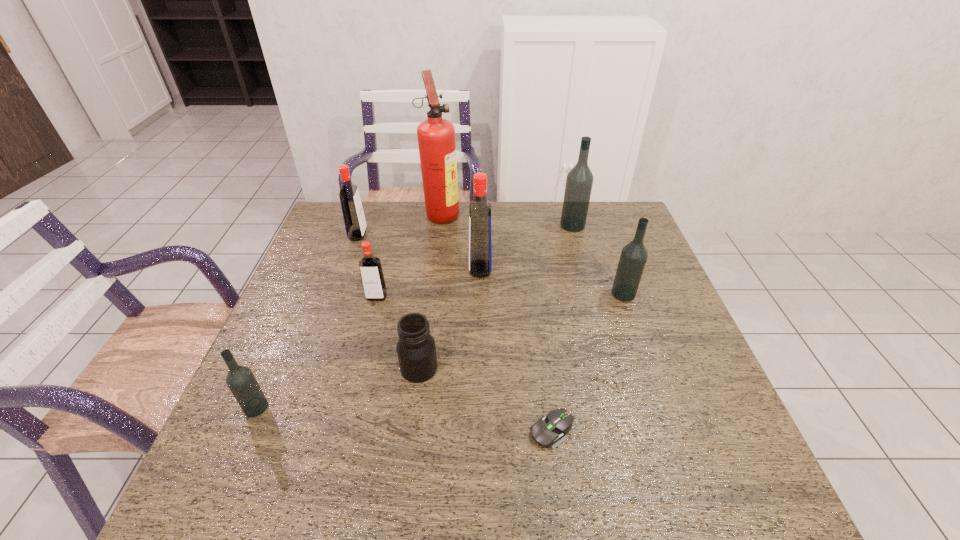
This screenshot has width=960, height=540. Find the location of `empty space between the farthest black vodka and the second smallest black vodka`. empty space between the farthest black vodka and the second smallest black vodka is located at coordinates (598, 259).

Locate an element on the screen. The image size is (960, 540). unoccupied area between the rightmost object and the second shortest object is located at coordinates (521, 331).

Where is `vacant space that is in between the rightmost vodka and the fourth nearest vodka`? vacant space that is in between the rightmost vodka and the fourth nearest vodka is located at coordinates (552, 281).

The height and width of the screenshot is (540, 960). In order to click on free spot between the nearest black vodka and the nearest red vodka in this screenshot , I will do coord(317,352).

What are the coordinates of `vacant space that is in between the tallest object and the seventh farthest object` in the screenshot? It's located at (430, 291).

Where is `object identified as the seventh closest to the second biggest black vodka`? The height and width of the screenshot is (540, 960). object identified as the seventh closest to the second biggest black vodka is located at coordinates (355, 224).

This screenshot has width=960, height=540. I want to click on the fifth closest object to the shortest object, so click(x=241, y=381).

Locate which vodka ranks third in proximity to the third object from left to right. Please provide its 2D coordinates. Your answer should be formatted as a tuple, i.e. [(x, y)], where the tuple contains the x and y coordinates of a point satisfying the conditions above.

[(241, 381)]

Locate which vodka is the closest to the second biggest black vodka. Please provide its 2D coordinates. Your answer should be formatted as a tuple, i.e. [(x, y)], where the tuple contains the x and y coordinates of a point satisfying the conditions above.

[(579, 181)]

Locate which black vodka is the third closest to the red fire extinguisher. Please provide its 2D coordinates. Your answer should be formatted as a tuple, i.e. [(x, y)], where the tuple contains the x and y coordinates of a point satisfying the conditions above.

[(241, 381)]